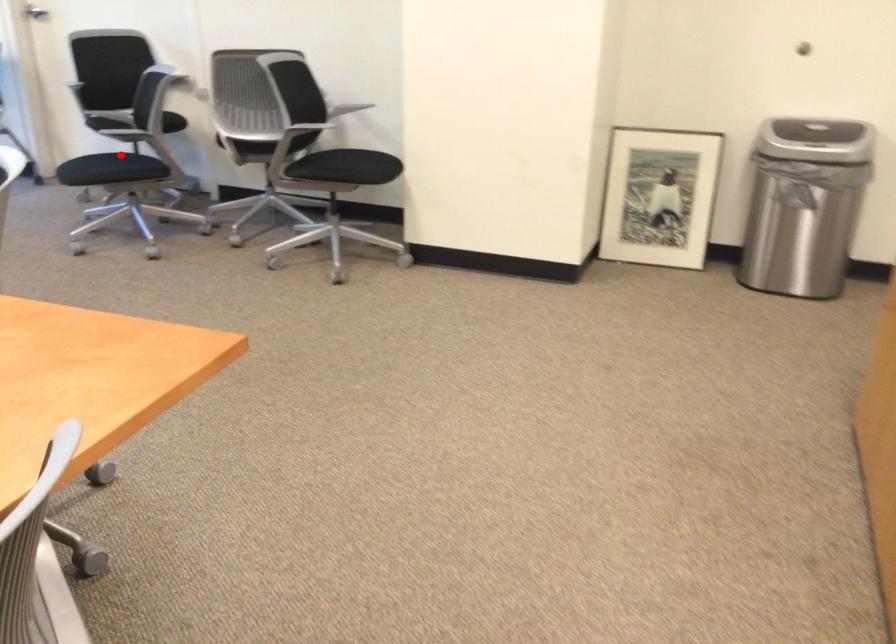
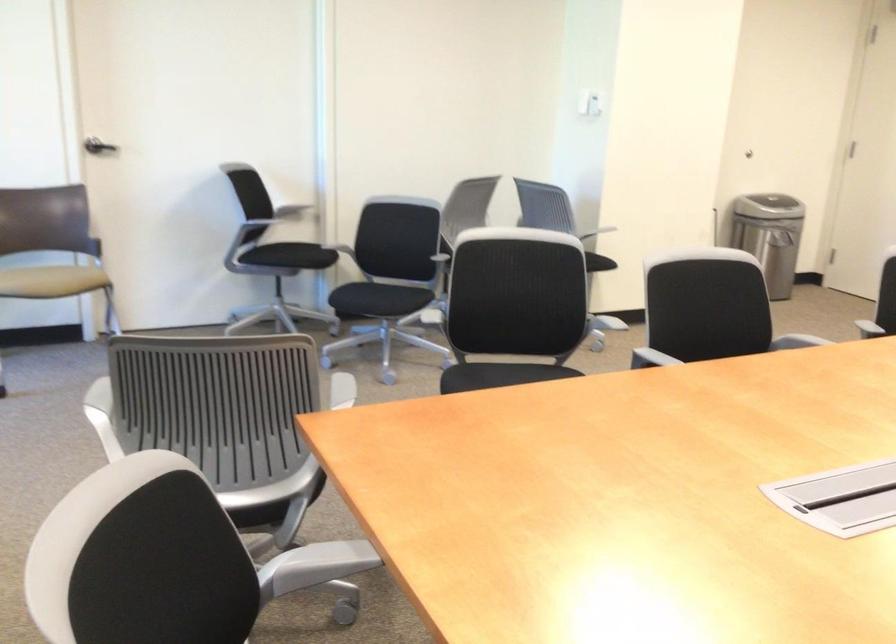
Find the pixel in the second image that matches the highlighted location in the first image.

(377, 299)